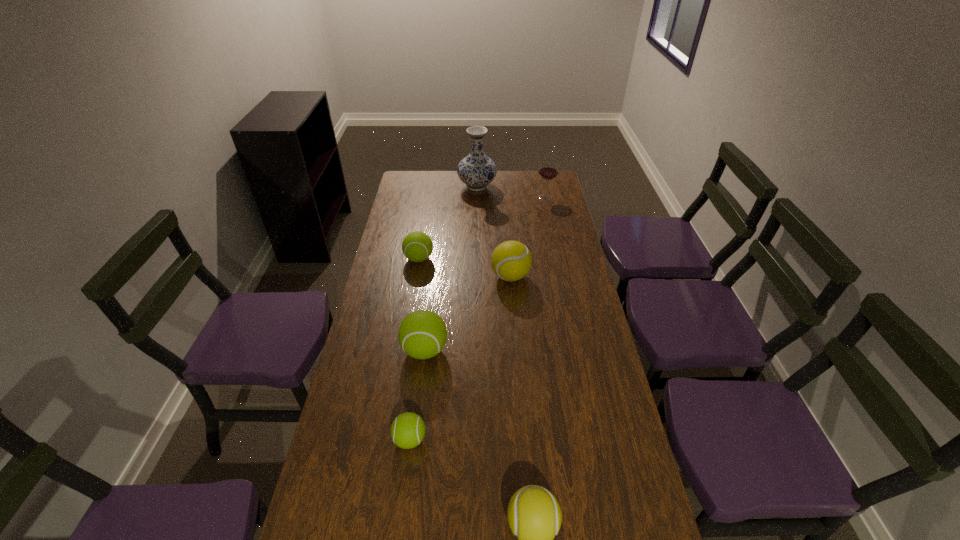
In the image, there is a desktop. Find the location of `free space at the far edge`. free space at the far edge is located at coordinates (514, 173).

In the image, there is a desktop. Where is `blank space at the left edge`? The image size is (960, 540). blank space at the left edge is located at coordinates (405, 237).

Locate an element on the screen. free spot at the right edge of the desktop is located at coordinates (606, 411).

Where is `free spot at the far right corner of the desktop`? Image resolution: width=960 pixels, height=540 pixels. free spot at the far right corner of the desktop is located at coordinates (539, 183).

Image resolution: width=960 pixels, height=540 pixels. I want to click on free space between the third farthest tennis ball and the red wineglass, so click(x=485, y=274).

Find the location of a particular element. Image resolution: width=960 pixels, height=540 pixels. free space that is in between the tallest object and the bigger yellow tennis ball is located at coordinates (493, 232).

At what (x,y) coordinates should I click in order to perform the action: click on empty location between the second nearest object and the farther yellow tennis ball. Please return your answer as a coordinate pair (x, y). This screenshot has height=540, width=960. Looking at the image, I should click on 460,358.

Find the location of a particular element. The width and height of the screenshot is (960, 540). empty space between the smallest green tennis ball and the red wineglass is located at coordinates (478, 318).

Identify the location of vacant region between the third farthest tennis ball and the rightmost object. The width and height of the screenshot is (960, 540). (485, 274).

Find the location of a particular element. This screenshot has width=960, height=540. vacant area that lies between the farther yellow tennis ball and the second nearest green tennis ball is located at coordinates click(468, 313).